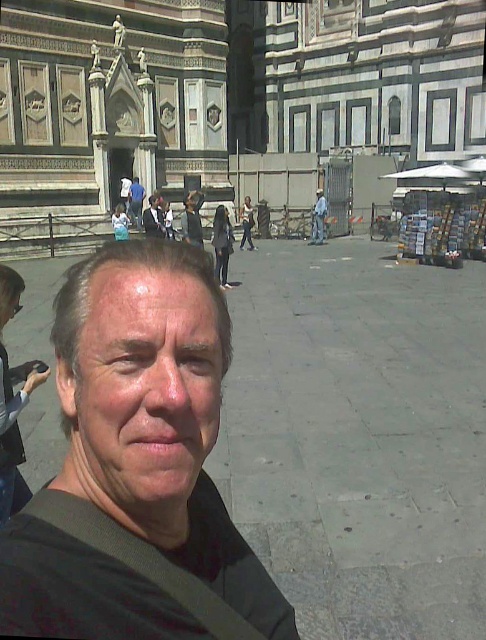
Question: Is matte black shirt at center positioned behind light blue jeans at center?

Choices:
 (A) no
 (B) yes

Answer: (A)

Question: Does matte black shirt at center have a greater width compared to light blue jeans at center?

Choices:
 (A) yes
 (B) no

Answer: (A)

Question: Which point is closer to the camera?

Choices:
 (A) matte black shirt at center
 (B) light blue jeans at center

Answer: (A)

Question: Can you confirm if matte black shirt at center is positioned above light blue jeans at center?

Choices:
 (A) yes
 (B) no

Answer: (B)